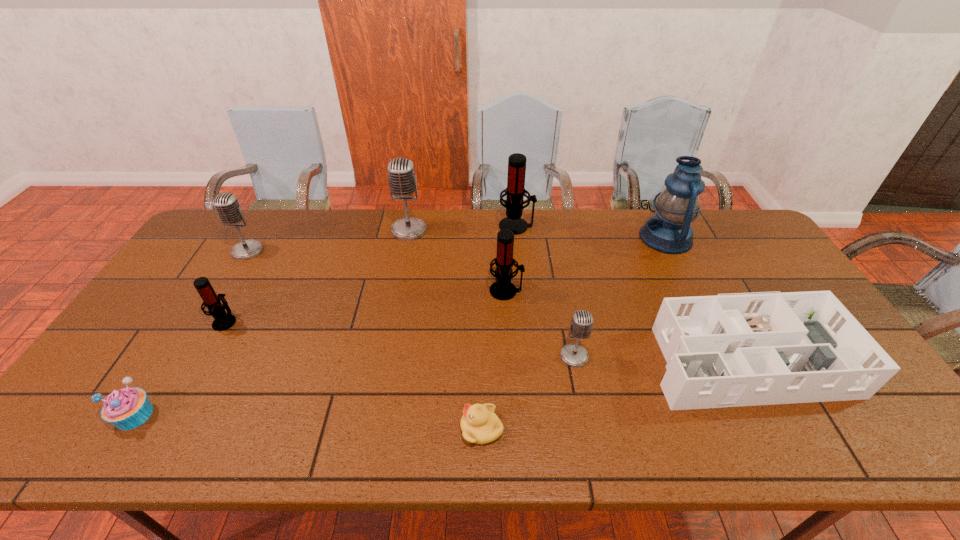
The height and width of the screenshot is (540, 960). In the image, there is a desktop. What are the coordinates of `vacant area at the near edge` in the screenshot? It's located at point(322,419).

The width and height of the screenshot is (960, 540). What are the coordinates of `free space at the left edge of the desktop` in the screenshot? It's located at (185, 319).

The width and height of the screenshot is (960, 540). In the image, there is a desktop. Find the location of `vacant area at the far left corner`. vacant area at the far left corner is located at coordinates (243, 231).

The height and width of the screenshot is (540, 960). In the image, there is a desktop. Find the location of `free space at the near left corner`. free space at the near left corner is located at coordinates (100, 427).

In the image, there is a desktop. Identify the location of free space at the far right corner. Image resolution: width=960 pixels, height=540 pixels. (745, 235).

Find the location of a particular element. Image resolution: width=960 pixels, height=540 pixels. vacant space that is in between the second farthest red microphone and the third farthest microphone is located at coordinates (376, 271).

You are a GUI agent. You are given a task and a screenshot of the screen. Output one action in this format:
    pyautogui.click(x=<x>, y=<y>)
    Task: Click on the free point between the second smallest red microphone and the third microphone from left to right
    The height and width of the screenshot is (540, 960).
    Given the screenshot: What is the action you would take?
    pyautogui.click(x=457, y=260)

Where is `vacant area between the nearest gray microphone and the second nearest red microphone`? This screenshot has width=960, height=540. vacant area between the nearest gray microphone and the second nearest red microphone is located at coordinates (540, 323).

Where is `free space between the lantern and the farthest red microphone`? free space between the lantern and the farthest red microphone is located at coordinates (591, 232).

Identify the location of vacant area between the shortest object and the eighth tallest object. The image size is (960, 540). (612, 390).